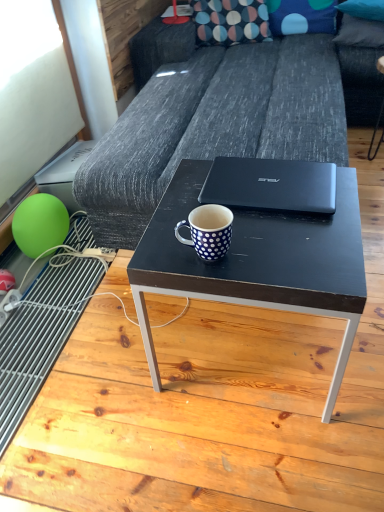
You are a GUI agent. You are given a task and a screenshot of the screen. Output one action in this format:
    pyautogui.click(x=<x>, y=<y>)
    Task: Click on the free space above matte black coffee table at center (from a real-world perspective)
    Image resolution: width=384 pixels, height=512 pixels.
    Given the screenshot: What is the action you would take?
    pyautogui.click(x=255, y=217)